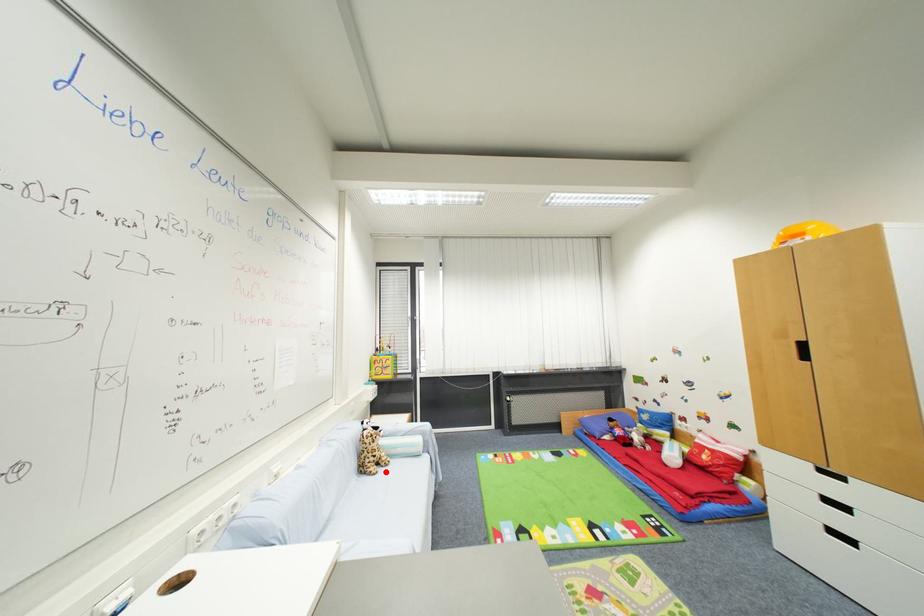
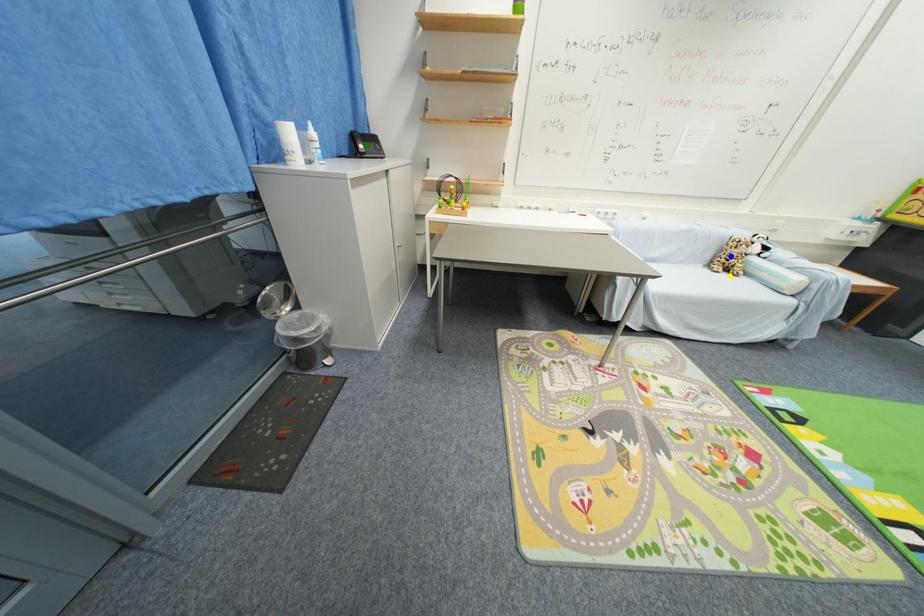
Question: I am providing you with two images of the same scene from different viewpoints. A red point is marked on the first image. You are given multiple points on the second image. Can you choose the point in image 2 that corresponds to the point in image 1?

Choices:
 (A) yellow point
 (B) green point
 (C) blue point

Answer: (A)